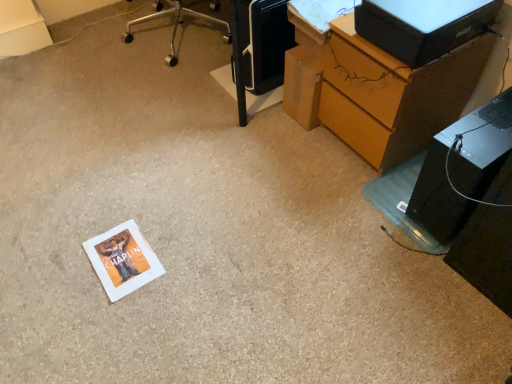
Question: Does black plastic computer tower at lower right have a smaller size compared to black plastic printer at upper center?

Choices:
 (A) yes
 (B) no

Answer: (A)

Question: Is black plastic computer tower at lower right to the left of black plastic printer at upper center from the viewer's perspective?

Choices:
 (A) yes
 (B) no

Answer: (B)

Question: Is black plastic computer tower at lower right oriented towards black plastic printer at upper center?

Choices:
 (A) yes
 (B) no

Answer: (B)

Question: Is black plastic computer tower at lower right turned away from black plastic printer at upper center?

Choices:
 (A) no
 (B) yes

Answer: (A)

Question: Is black plastic computer tower at lower right beside black plastic printer at upper center?

Choices:
 (A) no
 (B) yes

Answer: (A)

Question: Is black plastic printer at upper center inside or outside of black plastic desktop computer at upper right?

Choices:
 (A) inside
 (B) outside

Answer: (B)

Question: From a real-world perspective, relative to black plastic desktop computer at upper right, is black plastic printer at upper center vertically above or below?

Choices:
 (A) below
 (B) above

Answer: (A)

Question: Looking at their shapes, would you say black plastic printer at upper center is wider or thinner than black plastic desktop computer at upper right?

Choices:
 (A) thin
 (B) wide

Answer: (B)

Question: In the image, is black plastic printer at upper center positioned in front of or behind black plastic desktop computer at upper right?

Choices:
 (A) front
 (B) behind

Answer: (B)

Question: Looking at their shapes, would you say black plastic desktop computer at upper right is wider or thinner than black plastic computer tower at lower right?

Choices:
 (A) thin
 (B) wide

Answer: (A)

Question: In terms of height, does black plastic desktop computer at upper right look taller or shorter compared to black plastic computer tower at lower right?

Choices:
 (A) tall
 (B) short

Answer: (B)

Question: Would you say black plastic desktop computer at upper right is inside or outside black plastic computer tower at lower right?

Choices:
 (A) inside
 (B) outside

Answer: (B)

Question: From the image's perspective, is black plastic desktop computer at upper right positioned above or below black plastic computer tower at lower right?

Choices:
 (A) below
 (B) above

Answer: (B)

Question: In the image, is black plastic computer tower at lower right on the left side or the right side of wooden desk at lower right?

Choices:
 (A) right
 (B) left

Answer: (A)

Question: In the image, is black plastic computer tower at lower right positioned in front of or behind wooden desk at lower right?

Choices:
 (A) behind
 (B) front

Answer: (B)